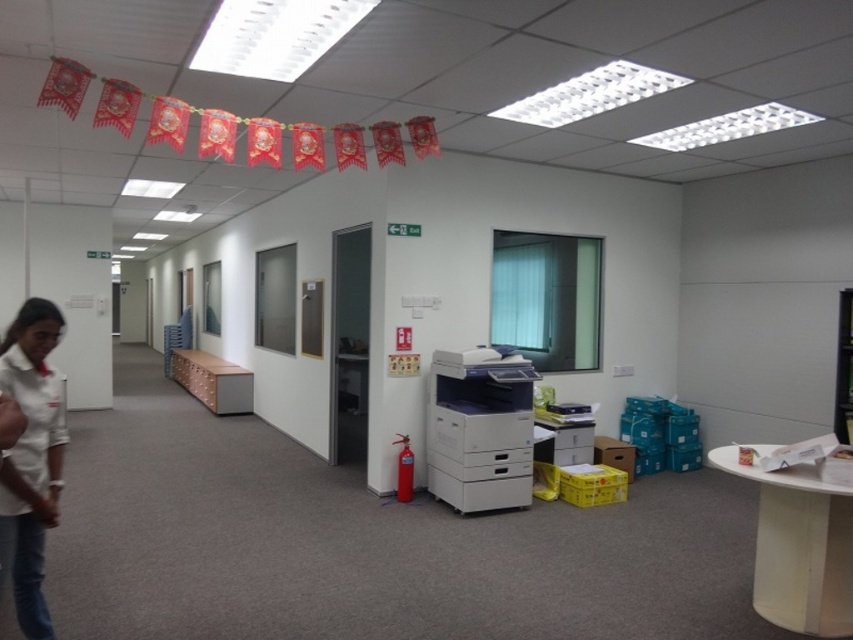
Between point (57, 326) and point (480, 365), which one is positioned in front?

Point (57, 326) is in front.

Image resolution: width=853 pixels, height=640 pixels. In order to click on white fabric shirt at left in this screenshot , I will do `click(32, 460)`.

Can you confirm if white fabric shirt at left is shorter than wooden/file cabinet at center?

No, white fabric shirt at left is not shorter than wooden/file cabinet at center.

Where is `white fabric shirt at left`? white fabric shirt at left is located at coordinates (32, 460).

This screenshot has width=853, height=640. Find the location of `white fabric shirt at left`. white fabric shirt at left is located at coordinates (32, 460).

I want to click on white plastic printer at center, so click(x=480, y=429).

Between white plastic printer at center and wooden/file cabinet at center, which one has less height?

wooden/file cabinet at center is shorter.

Does point (474, 396) come farther from viewer compared to point (212, 365)?

That is False.

The width and height of the screenshot is (853, 640). I want to click on white plastic printer at center, so click(x=480, y=429).